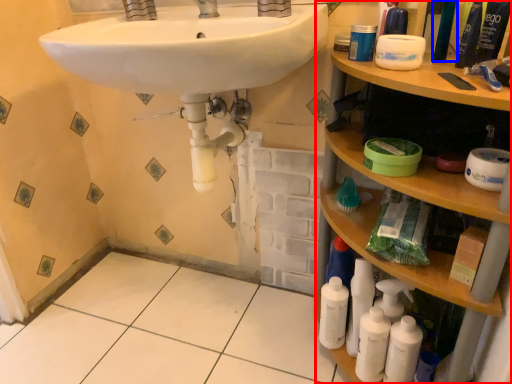
Question: Which object is closer to the camera taking this photo, cabinet (highlighted by a red box) or mouthwash (highlighted by a blue box)?

Choices:
 (A) cabinet
 (B) mouthwash

Answer: (A)